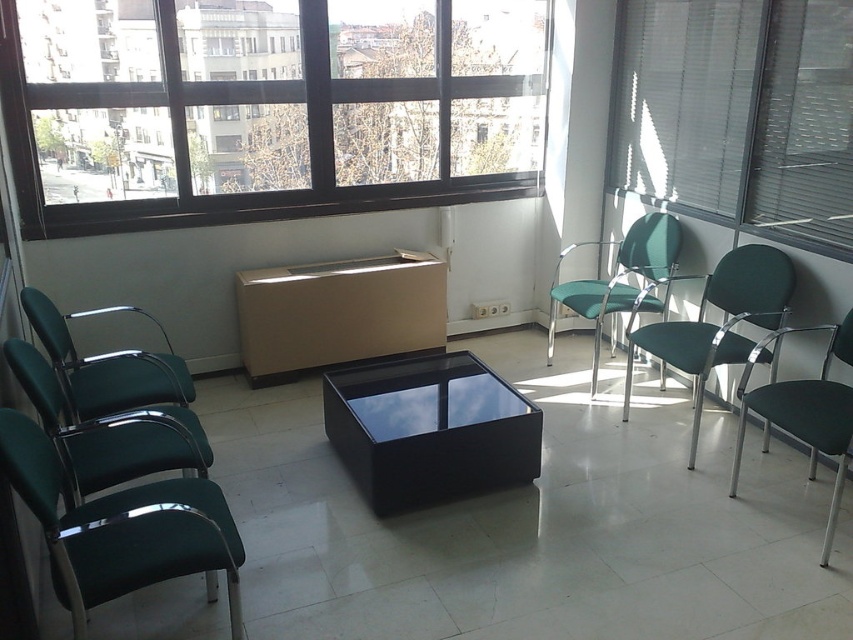
Question: Which object is farther from the camera taking this photo?

Choices:
 (A) glossy black coffee table at center
 (B) matte green chair at left
 (C) white blinds at upper right
 (D) green matte chair at right

Answer: (C)

Question: Observing the image, what is the correct spatial positioning of matte cardboard box at center in reference to green matte chair at right?

Choices:
 (A) left
 (B) right

Answer: (A)

Question: Estimate the real-world distances between objects in this image. Which object is farther from the white blinds at upper right?

Choices:
 (A) green plastic chair at left
 (B) green leather chair at left
 (C) green fabric chair at right
 (D) matte cardboard box at center

Answer: (A)

Question: Which of the following is the closest to the observer?

Choices:
 (A) (125, 413)
 (B) (228, 512)
 (C) (219, 86)
 (D) (671, 269)

Answer: (B)

Question: Is transparent glass window at upper center thinner than white blinds at upper right?

Choices:
 (A) yes
 (B) no

Answer: (B)

Question: Is transparent glass window at upper center to the right of matte cardboard box at center from the viewer's perspective?

Choices:
 (A) yes
 (B) no

Answer: (B)